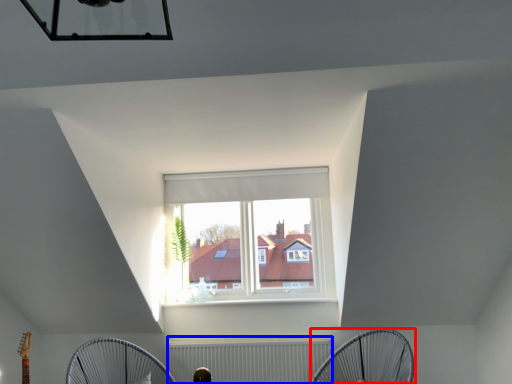
Question: Which of the following is the closest to the observer, mechanical fan (highlighted by a red box) or radiator (highlighted by a blue box)?

Choices:
 (A) mechanical fan
 (B) radiator

Answer: (A)